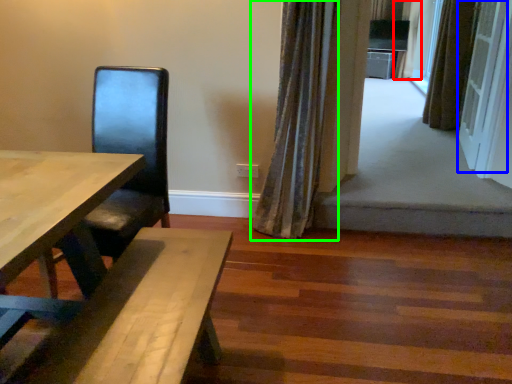
Question: Which is farther away from curtain (highlighted by a red box)? screen door (highlighted by a blue box) or curtain (highlighted by a green box)?

Choices:
 (A) screen door
 (B) curtain

Answer: (B)